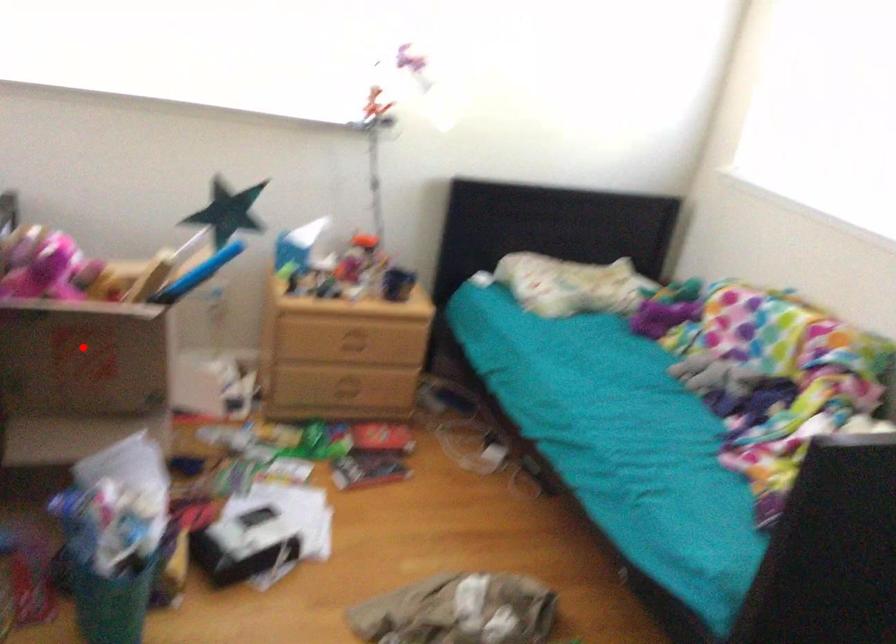
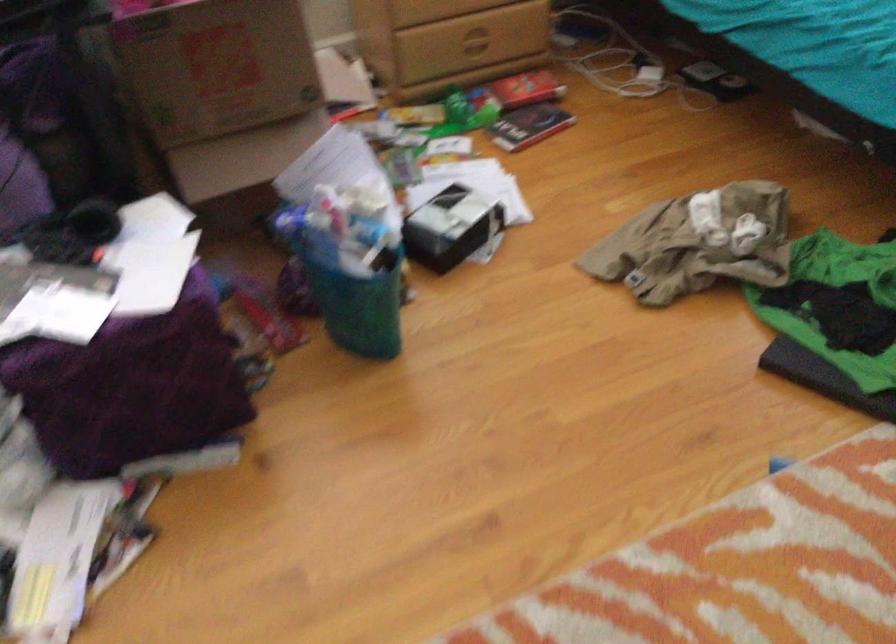
In the second image, find the point that corresponds to the highlighted location in the first image.

(216, 67)